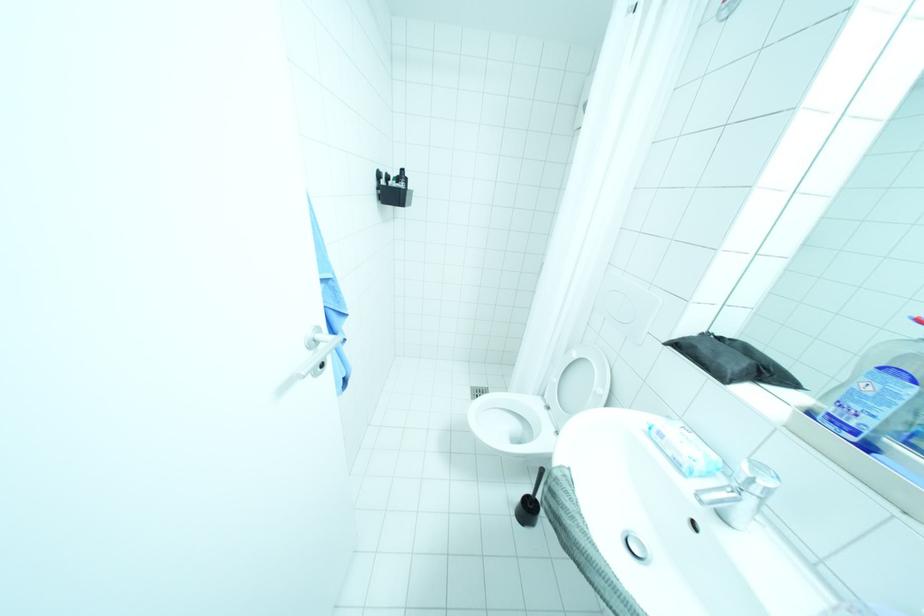
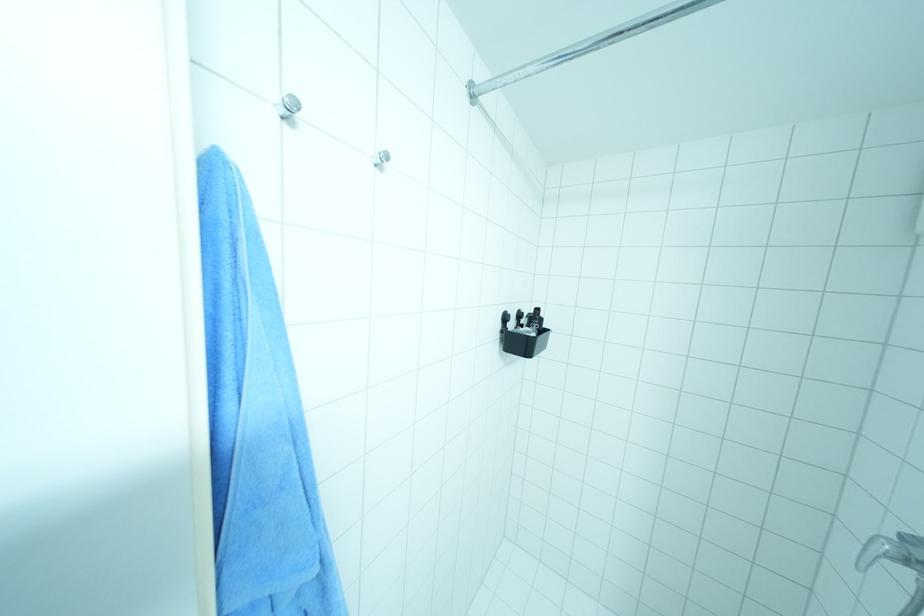
The point at (393, 182) is marked in the first image. Where is the corresponding point in the second image?

(520, 323)